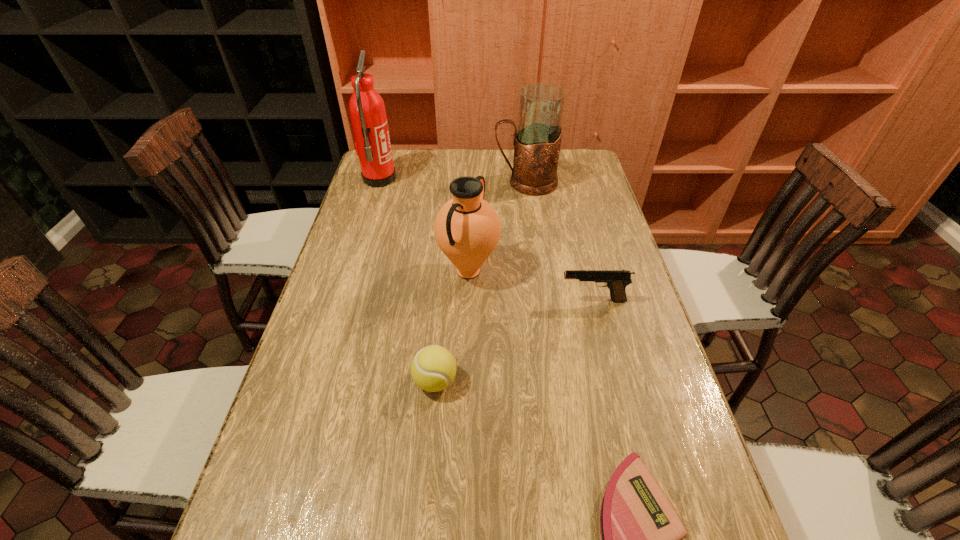
The image size is (960, 540). Find the location of `vacant region located 0.050m on the left of the nearer pitcher`. vacant region located 0.050m on the left of the nearer pitcher is located at coordinates (420, 271).

The width and height of the screenshot is (960, 540). Identify the location of vacant area situated at the muzzle of the third nearest object. (455, 301).

Where is `vacant space located at the muzzle of the third nearest object`? The image size is (960, 540). vacant space located at the muzzle of the third nearest object is located at coordinates (496, 301).

Where is `vacant space located at the muzzle of the third nearest object`? Image resolution: width=960 pixels, height=540 pixels. vacant space located at the muzzle of the third nearest object is located at coordinates (522, 301).

In order to click on blank area located 0.310m on the right of the tennis ball in this screenshot , I will do pyautogui.click(x=594, y=381).

Where is `fire extinguisher that is at the far edge`? This screenshot has height=540, width=960. fire extinguisher that is at the far edge is located at coordinates (367, 110).

Where is `pitcher positioned at the far edge`? pitcher positioned at the far edge is located at coordinates (537, 139).

What are the coordinates of `object situated at the left edge` in the screenshot? It's located at coord(367,110).

This screenshot has width=960, height=540. In order to click on pitcher located in the right edge section of the desktop in this screenshot , I will do `click(537, 139)`.

You are a GUI agent. You are given a task and a screenshot of the screen. Output one action in this format:
    pyautogui.click(x=<x>, y=<y>)
    Task: Click on the pistol that is at the right edge
    
    Given the screenshot: What is the action you would take?
    pyautogui.click(x=616, y=280)